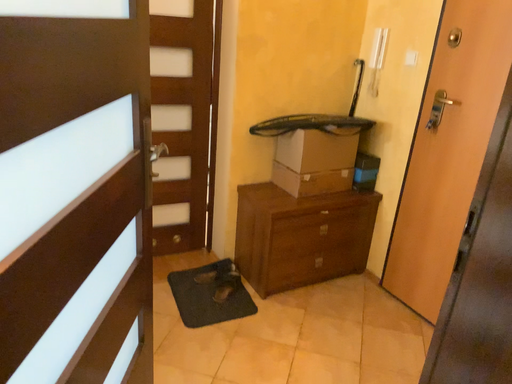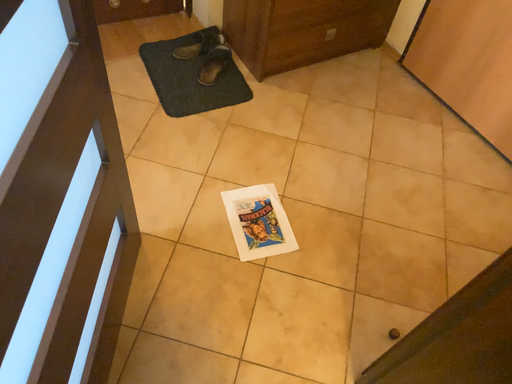
Question: How did the camera likely rotate when shooting the video?

Choices:
 (A) rotated downward
 (B) rotated upward

Answer: (A)